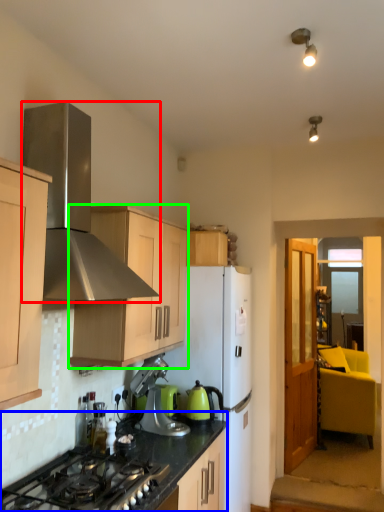
Question: Based on their relative distances, which object is nearer to home appliance (highlighted by a red box)? Choose from countertop (highlighted by a blue box) and cabinetry (highlighted by a green box).

Choices:
 (A) countertop
 (B) cabinetry

Answer: (B)